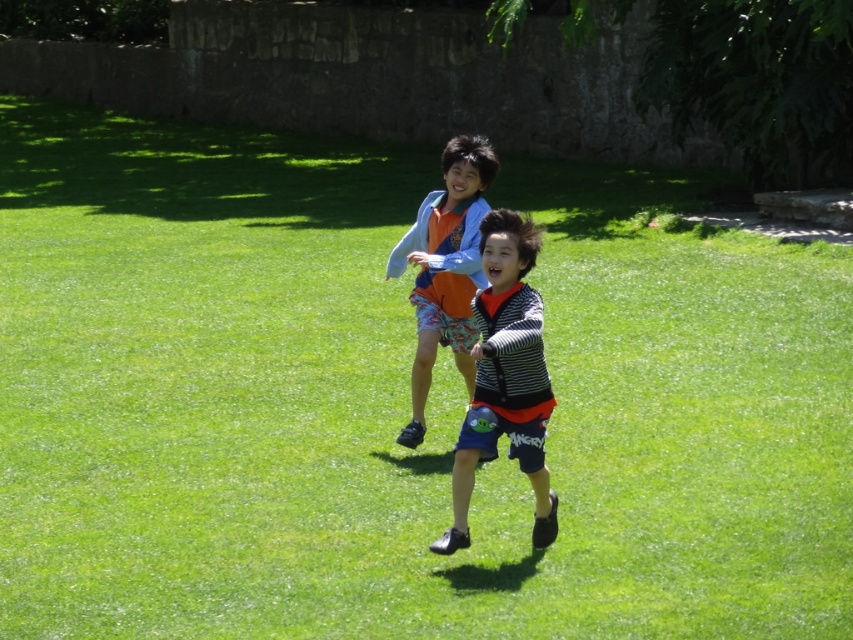
Question: Does striped fabric shirt at center appear under orange cotton shirt at center?

Choices:
 (A) no
 (B) yes

Answer: (B)

Question: Does striped fabric shirt at center appear on the right side of orange cotton shirt at center?

Choices:
 (A) no
 (B) yes

Answer: (B)

Question: Is striped fabric shirt at center bigger than orange cotton shirt at center?

Choices:
 (A) yes
 (B) no

Answer: (B)

Question: Which object is farther from the camera taking this photo?

Choices:
 (A) orange cotton shirt at center
 (B) striped fabric shirt at center

Answer: (A)

Question: Which of the following is the closest to the observer?

Choices:
 (A) (514, 236)
 (B) (473, 196)

Answer: (A)